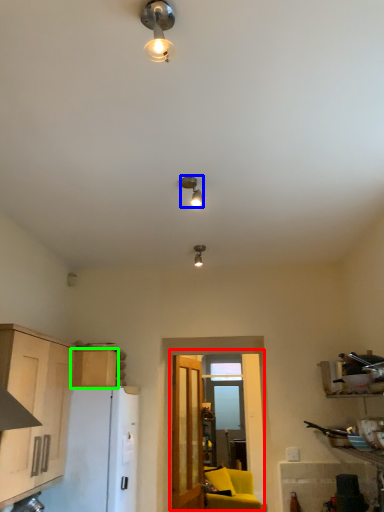
Question: Estimate the real-world distances between objects in this image. Which object is closer to glass door (highlighted by a red box), lamp (highlighted by a blue box) or cabinetry (highlighted by a green box)?

Choices:
 (A) lamp
 (B) cabinetry

Answer: (B)